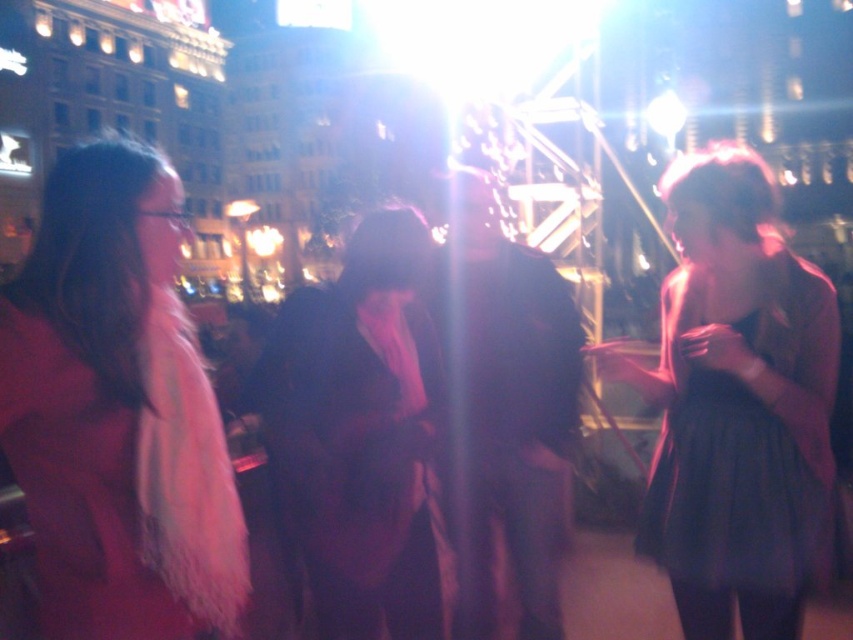
Question: Which point appears closest to the camera in this image?

Choices:
 (A) (350, 464)
 (B) (112, 380)
 (C) (457, 225)
 (D) (689, 275)

Answer: (B)

Question: Which point is farther from the camera taking this photo?

Choices:
 (A) (184, 474)
 (B) (274, 444)

Answer: (B)

Question: Which point is closer to the camera?

Choices:
 (A) matte black dress at right
 (B) dark brown leather jacket at center
 (C) velvet black coat at center

Answer: (A)

Question: Can you confirm if matte pink coat at left is smaller than dark brown leather jacket at center?

Choices:
 (A) yes
 (B) no

Answer: (A)

Question: Can you confirm if matte pink coat at left is bigger than dark brown leather jacket at center?

Choices:
 (A) yes
 (B) no

Answer: (B)

Question: Is matte black dress at right wider than dark brown leather jacket at center?

Choices:
 (A) no
 (B) yes

Answer: (B)